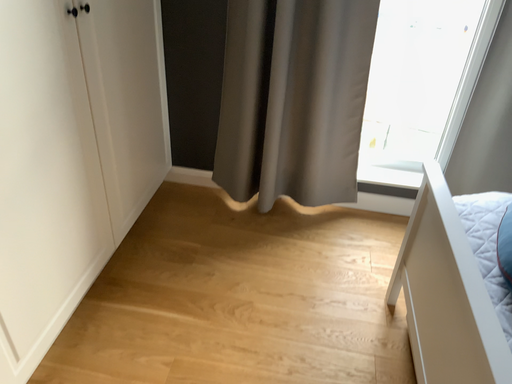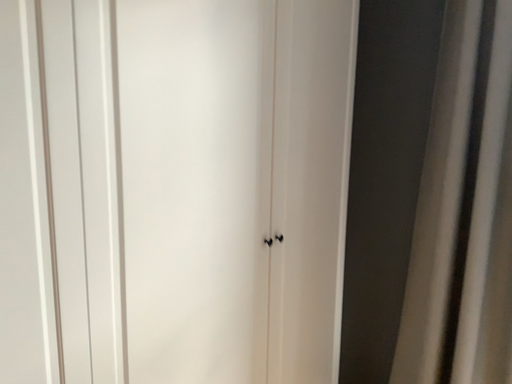
Question: How did the camera likely rotate when shooting the video?

Choices:
 (A) rotated right
 (B) rotated left

Answer: (B)